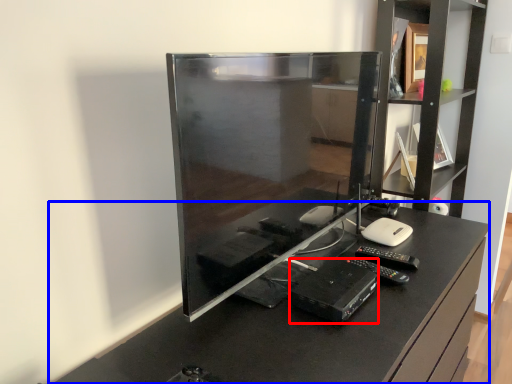
Question: Among these objects, which one is nearest to the camera, equipment (highlighted by a red box) or furniture (highlighted by a blue box)?

Choices:
 (A) equipment
 (B) furniture

Answer: (B)